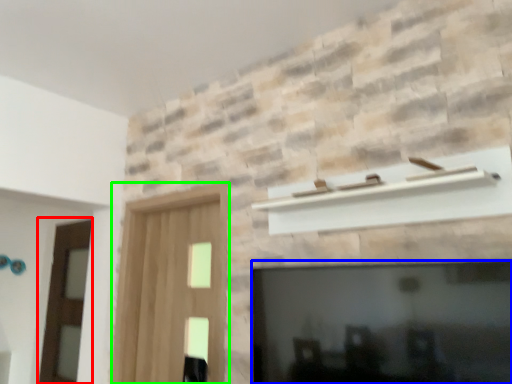
Question: Estimate the real-world distances between objects in this image. Which object is farther from screen door (highlighted by a red box), fireplace (highlighted by a blue box) or screen door (highlighted by a green box)?

Choices:
 (A) fireplace
 (B) screen door

Answer: (A)